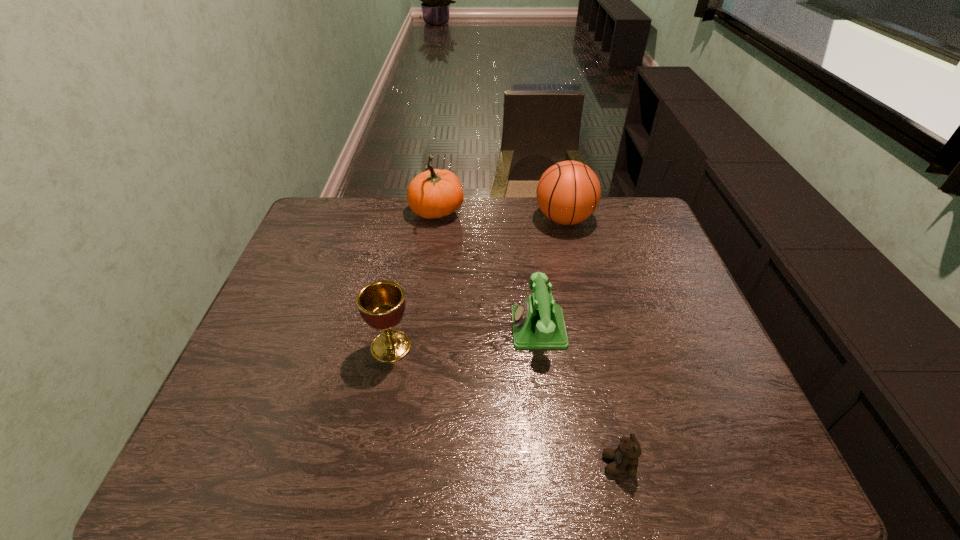
Locate an element on the screen. This screenshot has width=960, height=540. free space located 0.240m on the dial of the second shortest object is located at coordinates (420, 328).

I want to click on vacant space positioned on the dial of the second shortest object, so click(x=373, y=328).

Identify the location of vacant area situated 0.080m on the face of the teddy bear. 563,464.

The height and width of the screenshot is (540, 960). I want to click on free spot located on the face of the teddy bear, so click(x=484, y=464).

Where is `free spot located on the face of the teddy bear`? Image resolution: width=960 pixels, height=540 pixels. free spot located on the face of the teddy bear is located at coordinates (444, 464).

Identify the location of pumpkin present at the far edge. (435, 193).

The image size is (960, 540). What are the coordinates of `basketball that is at the far edge` in the screenshot? It's located at (568, 192).

Locate an element on the screen. The width and height of the screenshot is (960, 540). object located in the near edge section of the desktop is located at coordinates (625, 457).

In the image, there is a desktop. At what (x,y) coordinates should I click in order to perform the action: click on vacant space at the far edge. Please return your answer as a coordinate pair (x, y). This screenshot has width=960, height=540. Looking at the image, I should click on (498, 217).

At what (x,y) coordinates should I click in order to perform the action: click on free space at the near edge of the desktop. Please return your answer as a coordinate pair (x, y). The height and width of the screenshot is (540, 960). Looking at the image, I should click on (515, 451).